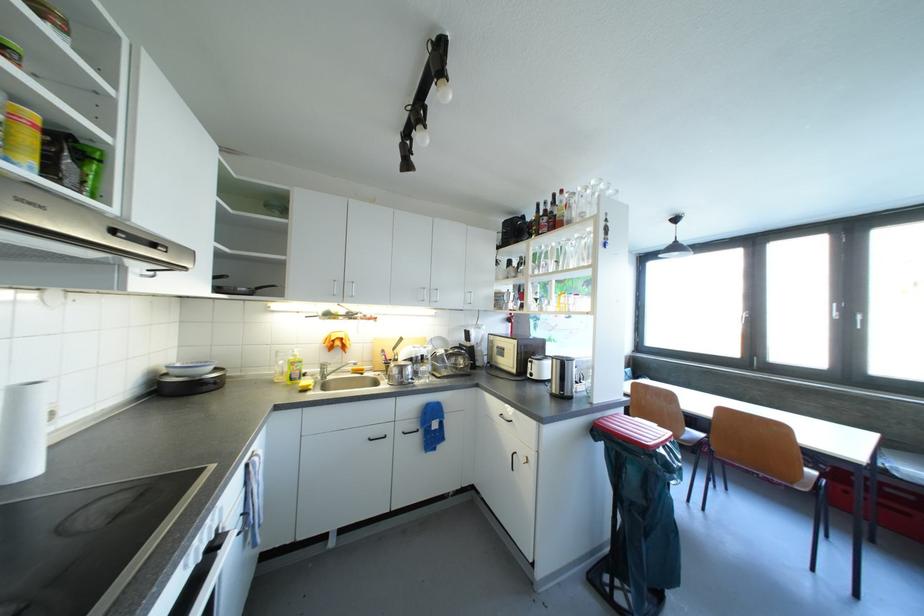
This screenshot has height=616, width=924. What are the coordinates of `faucet handle` in the screenshot? It's located at (330, 361).